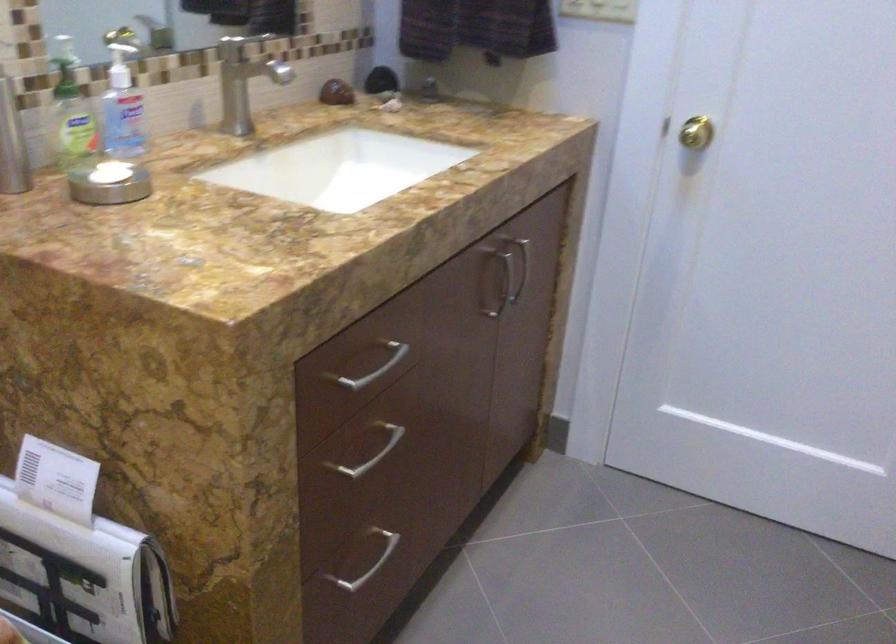
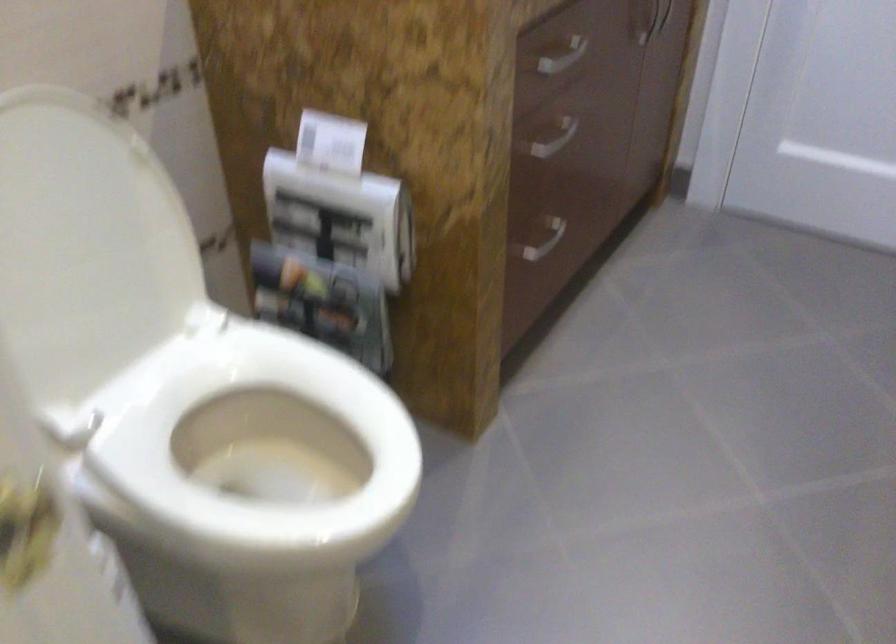
Locate, in the second image, the point that corresponds to point 80,564 in the first image.

(341, 216)